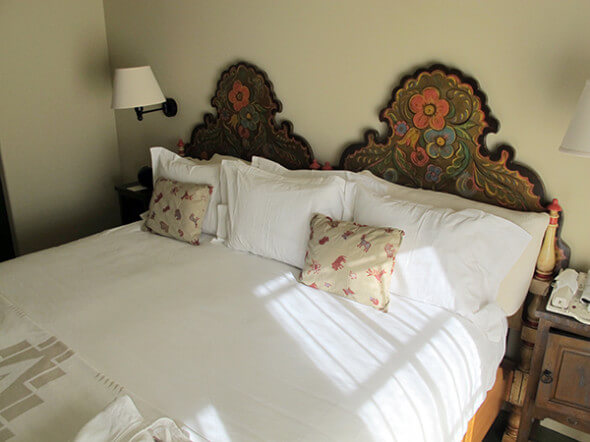
The image size is (590, 442). What are the coordinates of `wall` in the screenshot? It's located at (343, 59), (37, 80).